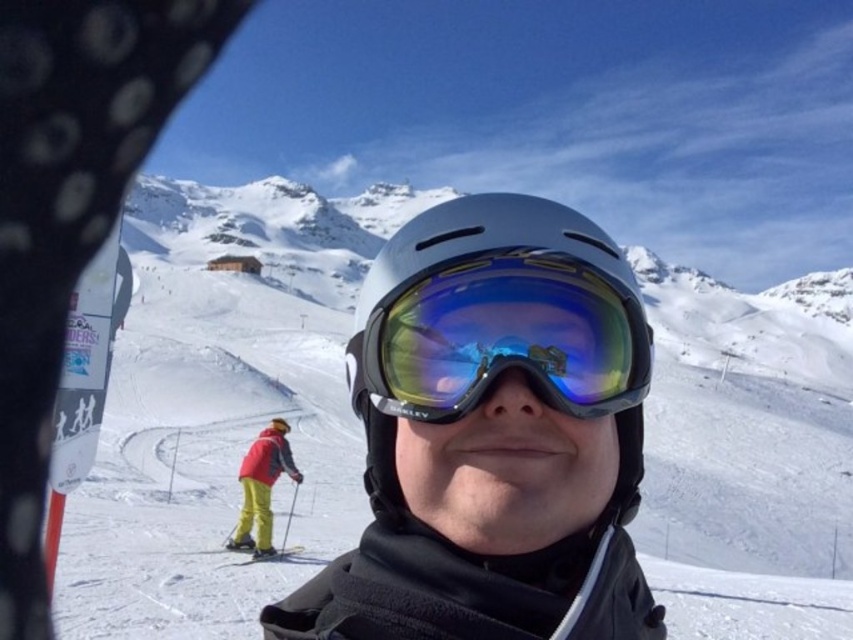
Which is behind, point (372, 476) or point (256, 557)?

The point (256, 557) is behind.

Between point (560, 396) and point (305, 560), which one is positioned in front?

Point (560, 396) is more forward.

Where is `matte gray helmet at center`? The height and width of the screenshot is (640, 853). matte gray helmet at center is located at coordinates (495, 323).

Is white matte snow at center above yellow matte ski at lower center?

Yes, white matte snow at center is above yellow matte ski at lower center.

Consider the image. Who is lower down, white matte snow at center or yellow matte ski at lower center?

yellow matte ski at lower center

Is point (705, 604) more distant than point (271, 557)?

No, (705, 604) is closer to viewer.

At what (x,y) coordinates should I click in order to perform the action: click on white matte snow at center. Please return your answer as a coordinate pair (x, y). The image size is (853, 640). Looking at the image, I should click on (221, 404).

Is white matte snow at center to the left of matte gray helmet at center from the viewer's perspective?

Correct, you'll find white matte snow at center to the left of matte gray helmet at center.

Is point (354, 248) positioned before point (561, 253)?

No, it is behind (561, 253).

Between point (273, 308) and point (390, 342), which one is positioned in front?

Positioned in front is point (390, 342).

The image size is (853, 640). I want to click on white matte snow at center, so click(221, 404).